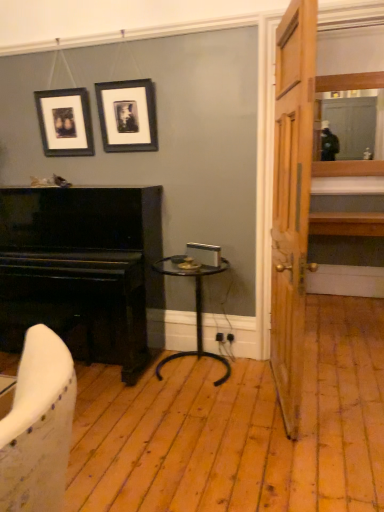
In order to click on vacant point above matte black picture frame at upper left, the second picture frame from the right (from a real-world perspective) in this screenshot , I will do `click(60, 91)`.